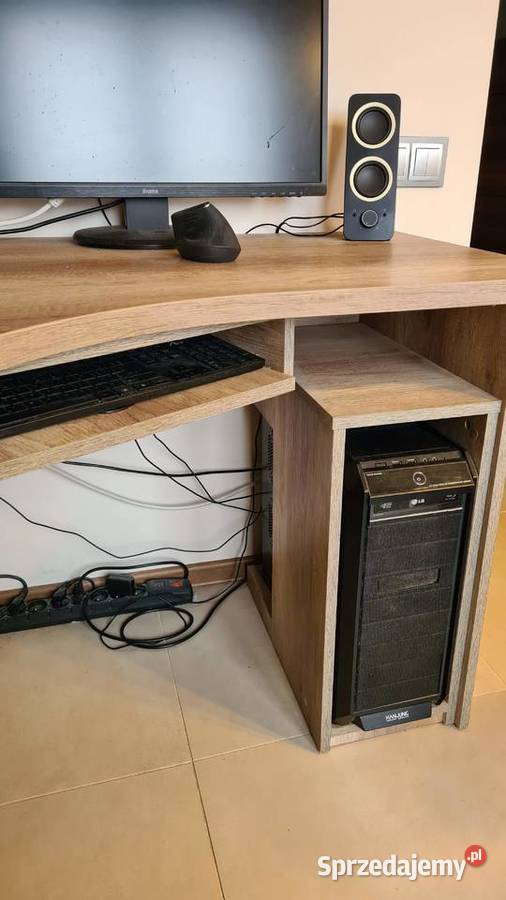
Find the location of a particular element. The width and height of the screenshot is (506, 900). wood computer desk housing is located at coordinates (317, 507).